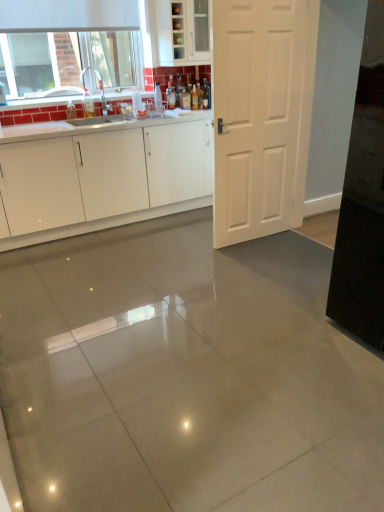
Question: In the image, is translucent glass bottle at center, placed as the 1th bottle when sorted from right to left, positioned in front of or behind translucent amber bottle at upper center, which is the 3th bottle from left to right?

Choices:
 (A) front
 (B) behind

Answer: (B)

Question: Considering the positions of translucent glass bottle at center, placed as the fourth bottle when sorted from left to right, and translucent amber bottle at upper center, which is the 3th bottle from left to right, in the image, is translucent glass bottle at center, placed as the fourth bottle when sorted from left to right, wider or thinner than translucent amber bottle at upper center, which is the 3th bottle from left to right,?

Choices:
 (A) thin
 (B) wide

Answer: (B)

Question: Considering the real-world distances, which object is farthest from the white glossy cabinet at upper center, the second cabinetry positioned from the bottom?

Choices:
 (A) white matte window at upper left
 (B) white matte exhaust hood at upper left
 (C) translucent amber bottle at upper center, which is the 3th bottle from left to right
 (D) translucent plastic bottle at upper left, positioned as the 4th bottle in right-to-left order
 (E) white glossy cabinetry at center, marked as the 2th cabinetry in a top-to-bottom arrangement

Answer: (D)

Question: Which of these objects is positioned farthest from the white matte window at upper left?

Choices:
 (A) translucent plastic bottle at upper left, placed as the 1th bottle when sorted from left to right
 (B) white matte exhaust hood at upper left
 (C) white matte door at center
 (D) white glossy cabinetry at center, the first cabinetry positioned from the bottom
 (E) white glossy cabinet at upper center, acting as the 1th cabinetry starting from the top

Answer: (C)